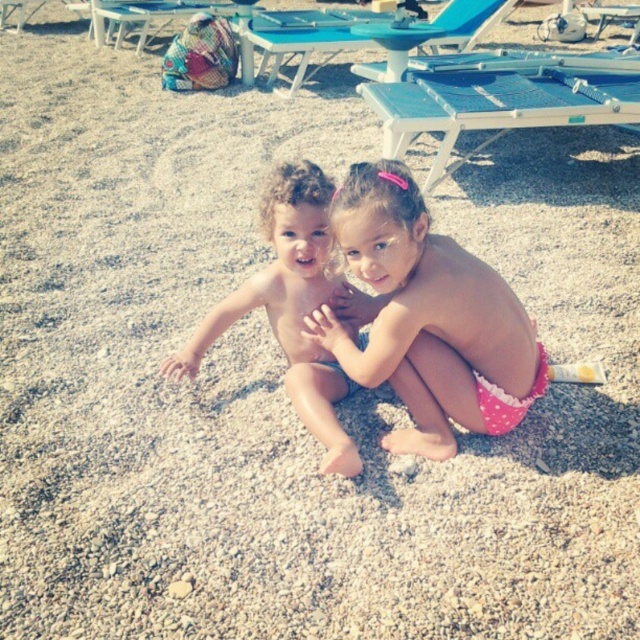
From the picture: Is pink polka dot swimsuit at center closer to the viewer compared to smooth skin children at center?

Yes, pink polka dot swimsuit at center is closer to the viewer.

Consider the image. Is pink polka dot swimsuit at center bigger than smooth skin children at center?

Yes.

Which is in front, point (452, 304) or point (314, 195)?

Positioned in front is point (452, 304).

The height and width of the screenshot is (640, 640). In order to click on pink polka dot swimsuit at center in this screenshot , I will do `click(426, 317)`.

How distant is smooth skin children at center from multicolored woven bag at upper left?

The distance of smooth skin children at center from multicolored woven bag at upper left is 7.88 meters.

Is smooth skin children at center to the left of multicolored woven bag at upper left from the viewer's perspective?

In fact, smooth skin children at center is to the right of multicolored woven bag at upper left.

The height and width of the screenshot is (640, 640). In order to click on smooth skin children at center in this screenshot , I will do `click(289, 307)`.

Between pink polka dot swimsuit at center and multicolored woven bag at upper left, which one appears on the left side from the viewer's perspective?

Positioned to the left is multicolored woven bag at upper left.

What are the coordinates of `pink polka dot swimsuit at center` in the screenshot? It's located at (426, 317).

Is point (436, 340) farther from viewer compared to point (108, 26)?

No, (436, 340) is in front of (108, 26).

I want to click on pink polka dot swimsuit at center, so click(x=426, y=317).